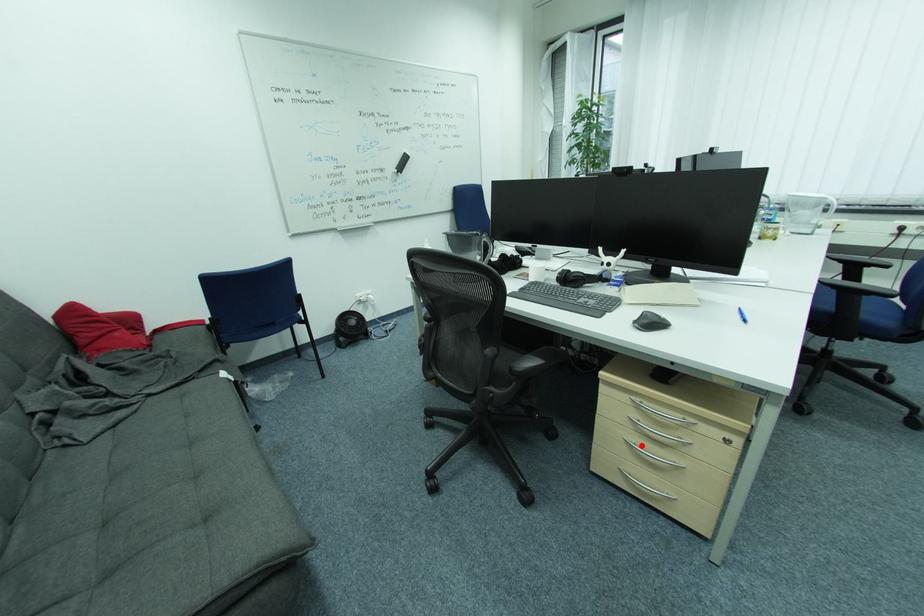
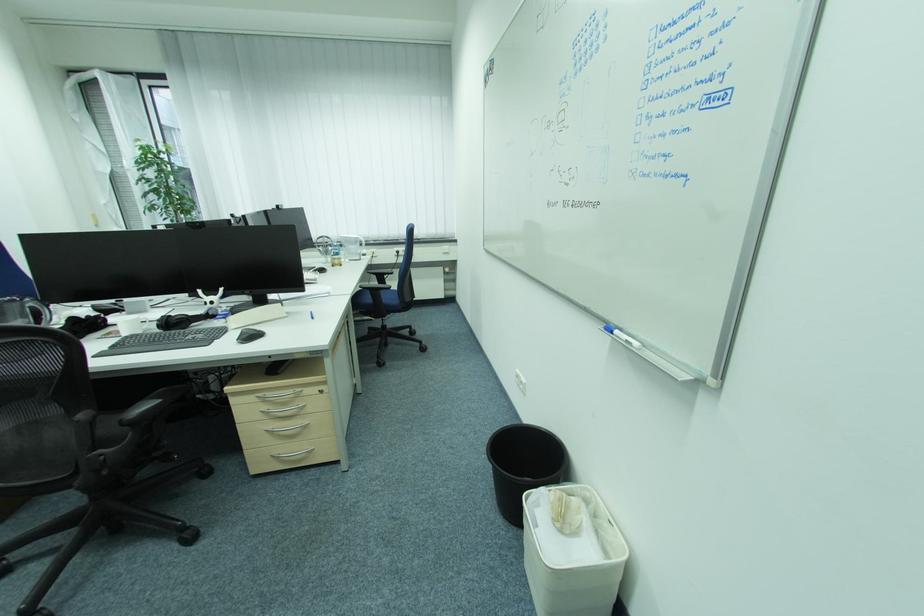
Question: I am providing you with two images of the same scene from different viewpoints. In image1, a red point is highlighted. Considering the same 3D point in image2, which of the following is correct?

Choices:
 (A) It is closer
 (B) It is farther

Answer: (B)